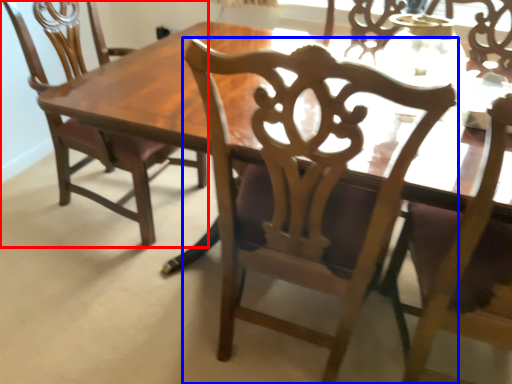
Question: Which point is closer to the camera, chair (highlighted by a red box) or chair (highlighted by a blue box)?

Choices:
 (A) chair
 (B) chair

Answer: (B)